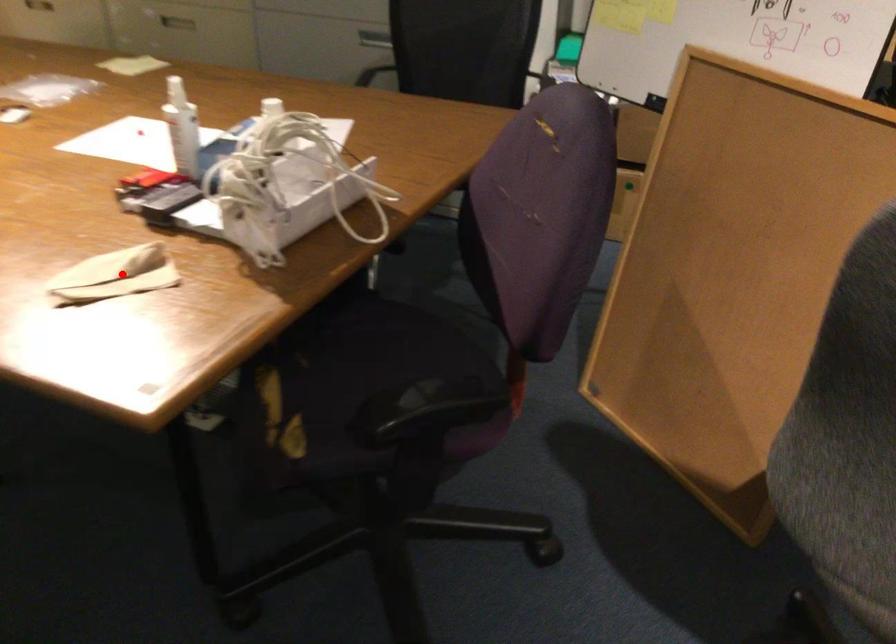
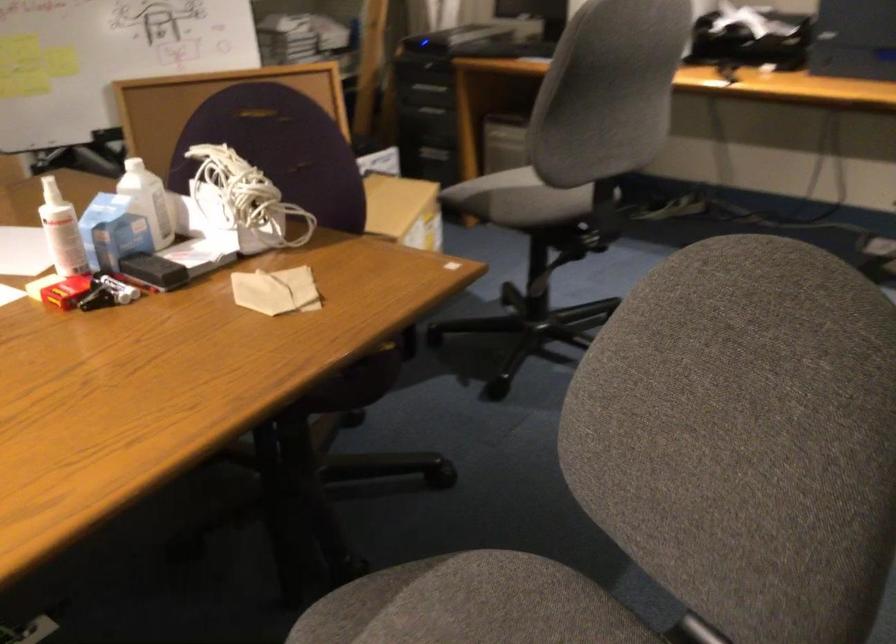
Locate, in the second image, the point that corresponds to the highlighted location in the first image.

(276, 290)